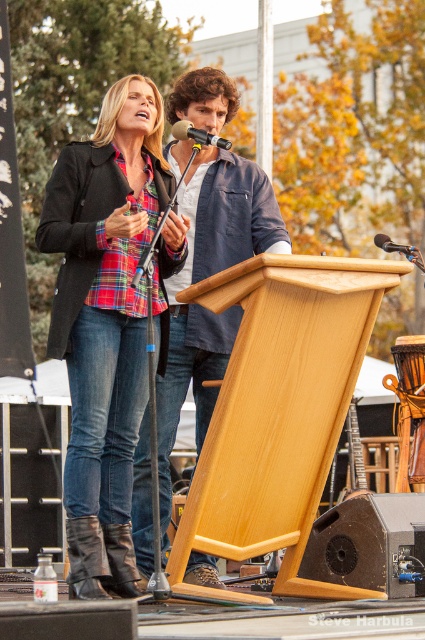
Question: Which object is closer to the camera taking this photo?

Choices:
 (A) wooden podium at center
 (B) metallic silver microphone at center
 (C) matte black microphone at center
 (D) natural wood podium at center

Answer: (D)

Question: Which of the following is the closest to the observer?

Choices:
 (A) (203, 134)
 (B) (163, 256)
 (C) (221, 474)

Answer: (C)

Question: Does leather boots at lower left have a larger size compared to metallic silver microphone at center?

Choices:
 (A) yes
 (B) no

Answer: (B)

Question: Does wooden podium at center have a greater width compared to black matte speaker at lower center?

Choices:
 (A) no
 (B) yes

Answer: (B)

Question: Does black matte speaker at lower center appear on the left side of metallic silver microphone at center?

Choices:
 (A) yes
 (B) no

Answer: (A)

Question: Which point is closer to the camera taking this photo?

Choices:
 (A) (388, 241)
 (B) (98, 550)
 (C) (141, 323)

Answer: (B)